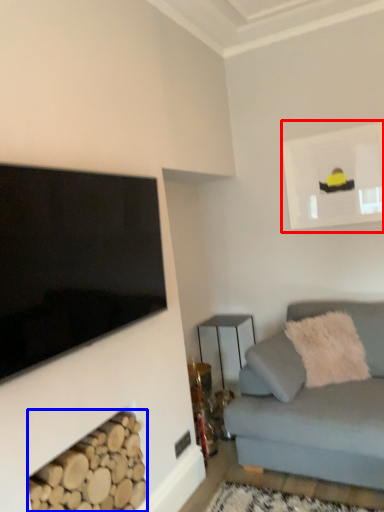
Question: Which object appears closest to the camera in this image, picture frame (highlighted by a red box) or wood (highlighted by a blue box)?

Choices:
 (A) picture frame
 (B) wood

Answer: (B)